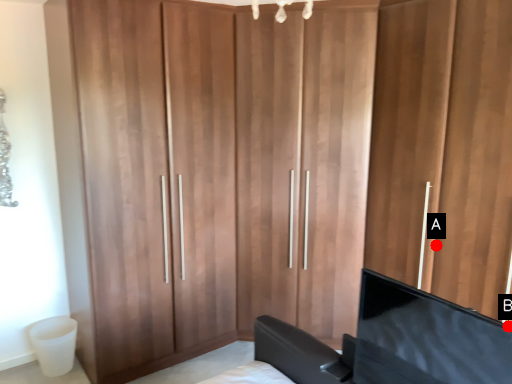
Question: Two points are circled on the image, labeled by A and B beside each circle. Which point is closer to the camera?

Choices:
 (A) A is closer
 (B) B is closer

Answer: (B)